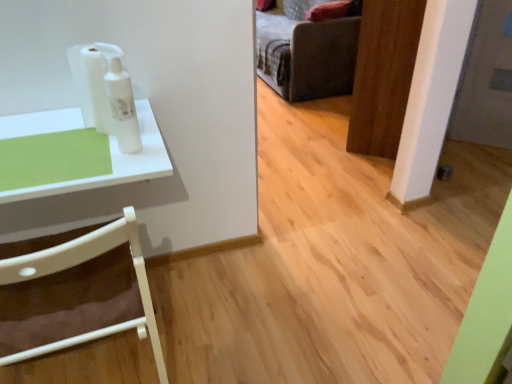
This screenshot has height=384, width=512. Identify the location of spots to the right of white plastic chair at left. (230, 342).